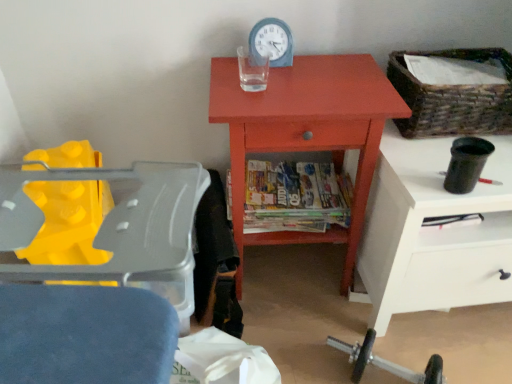
This screenshot has height=384, width=512. In order to click on free spot to the right of blue plastic clock at upper center in this screenshot , I will do `click(328, 67)`.